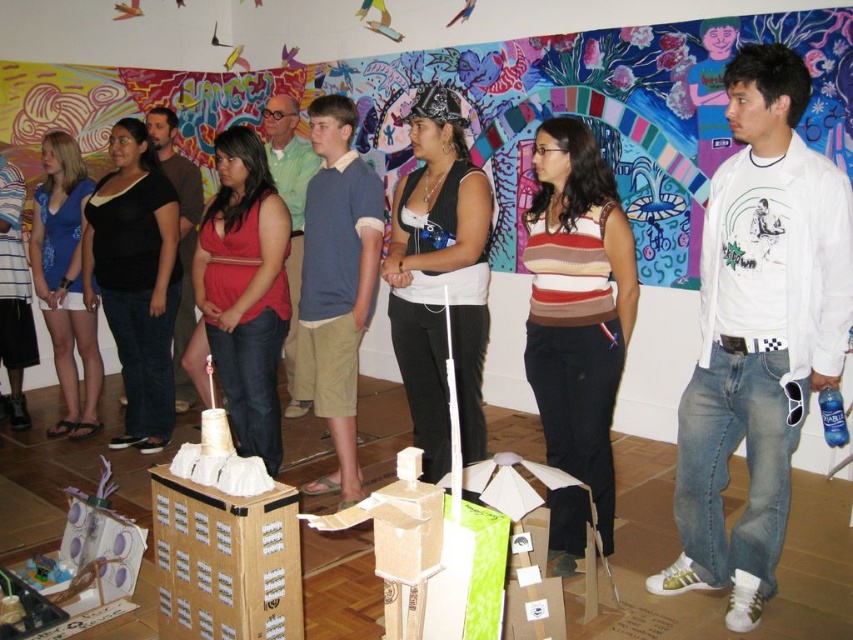
Question: Is blue cotton shirt at center below black cotton shirt at center?

Choices:
 (A) no
 (B) yes

Answer: (B)

Question: Which object appears closest to the camera in this image?

Choices:
 (A) black cotton shirt at center
 (B) blue cotton shirt at center

Answer: (B)

Question: Is the position of blue cotton shirt at center more distant than that of black cotton shirt at center?

Choices:
 (A) no
 (B) yes

Answer: (A)

Question: Which of the following is the farthest from the observer?

Choices:
 (A) (297, 237)
 (B) (149, 129)

Answer: (B)

Question: Among these points, which one is nearest to the camera?

Choices:
 (A) (158, 156)
 (B) (279, 136)

Answer: (B)

Question: Is blue cotton shirt at center to the right of black cotton shirt at center from the viewer's perspective?

Choices:
 (A) yes
 (B) no

Answer: (A)